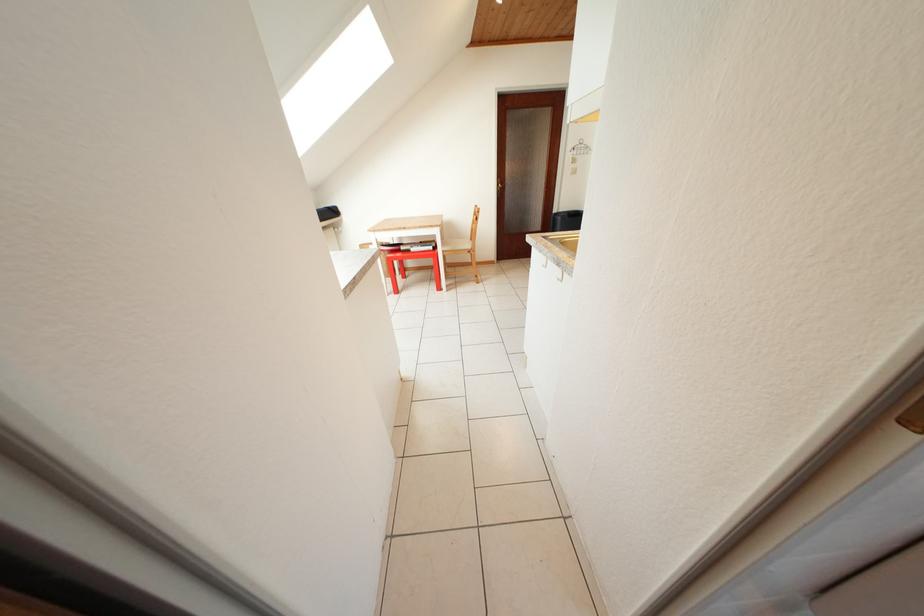
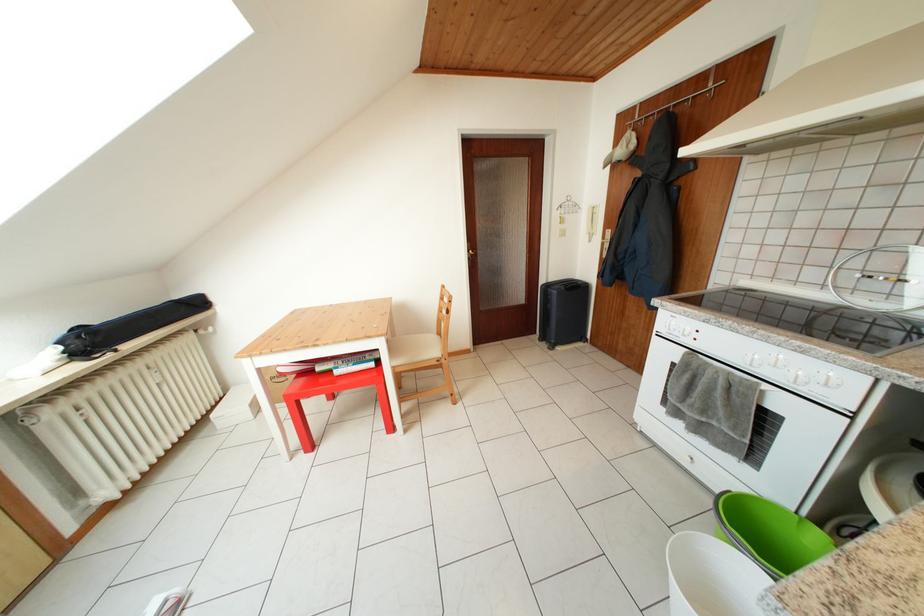
Where in the second image is the point corresponding to [563,216] from the first image?

(551, 286)